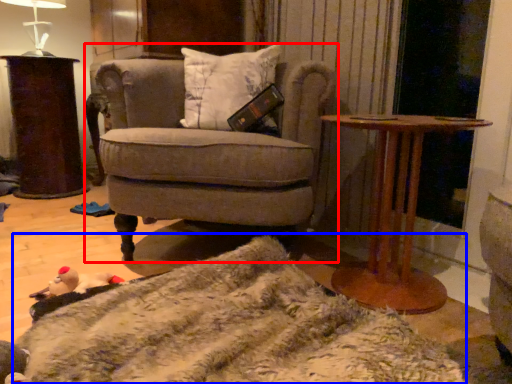
Question: Which object appears closest to the camera in this image, chair (highlighted by a red box) or blanket (highlighted by a blue box)?

Choices:
 (A) chair
 (B) blanket

Answer: (B)